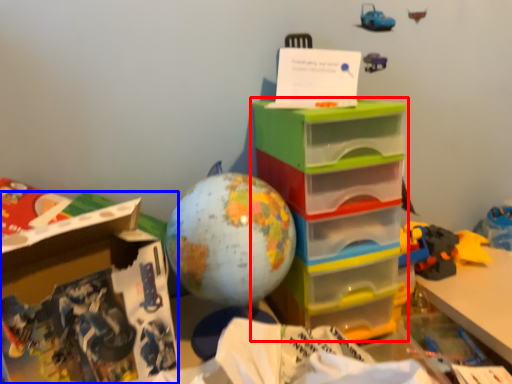
Question: Which object is closer to the camera taking this photo, storage box (highlighted by a red box) or cardboard box (highlighted by a blue box)?

Choices:
 (A) storage box
 (B) cardboard box

Answer: (B)